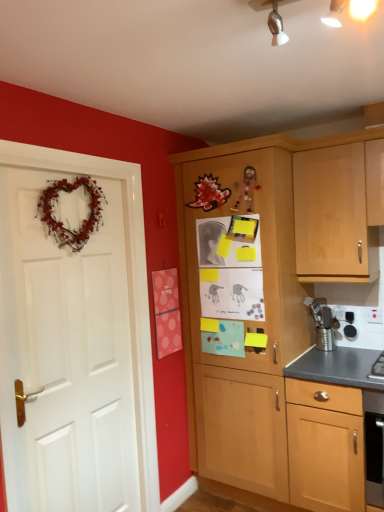
Question: Is pink polka dot postcard at center situated inside metallic silver utensil holder at right or outside?

Choices:
 (A) outside
 (B) inside

Answer: (A)

Question: In terms of height, does pink polka dot postcard at center look taller or shorter compared to metallic silver utensil holder at right?

Choices:
 (A) tall
 (B) short

Answer: (A)

Question: Considering the real-world distances, which object is closest to the wooden cabinet at center?

Choices:
 (A) pink polka dot postcard at center
 (B) metallic silver utensil holder at right
 (C) white matte door at left

Answer: (A)

Question: Which is farther from the wooden cabinet at center?

Choices:
 (A) pink polka dot postcard at center
 (B) white matte door at left
 (C) metallic silver utensil holder at right

Answer: (B)